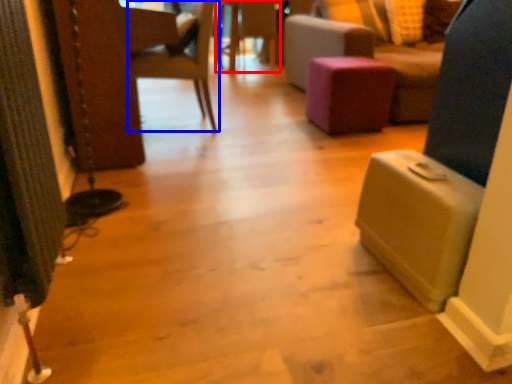
Question: Which object is closer to the camera taking this photo, side table (highlighted by a red box) or chair (highlighted by a blue box)?

Choices:
 (A) side table
 (B) chair

Answer: (B)